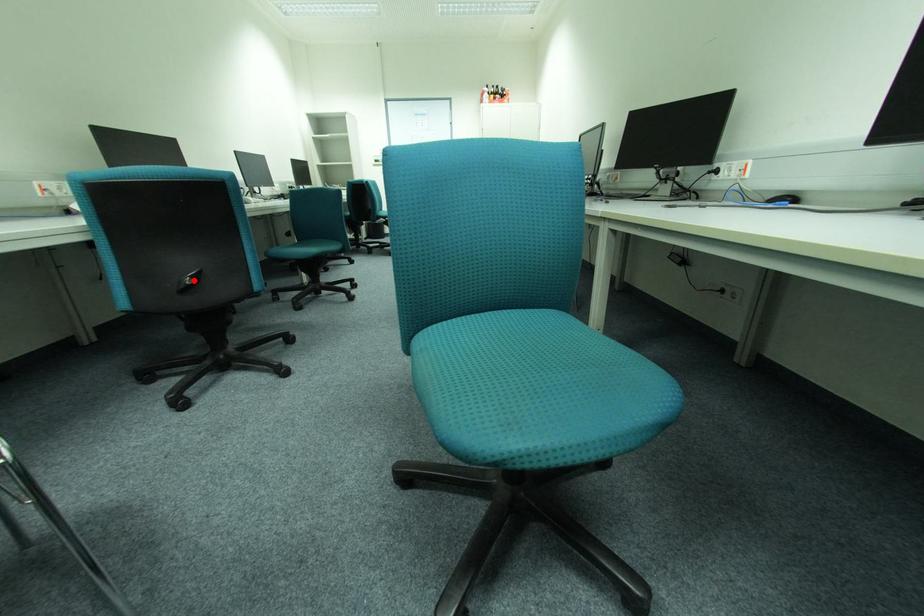
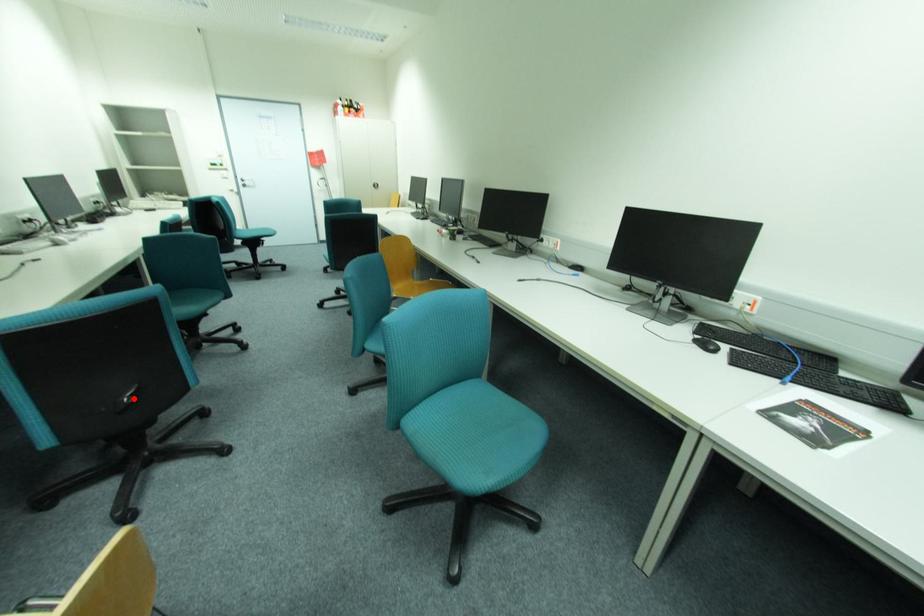
I am providing you with two images of the same scene from different viewpoints. A red point is marked on the first image and another point is marked on the second image. Do the highlighted points in image1 and image2 indicate the same real-world spot?

Yes